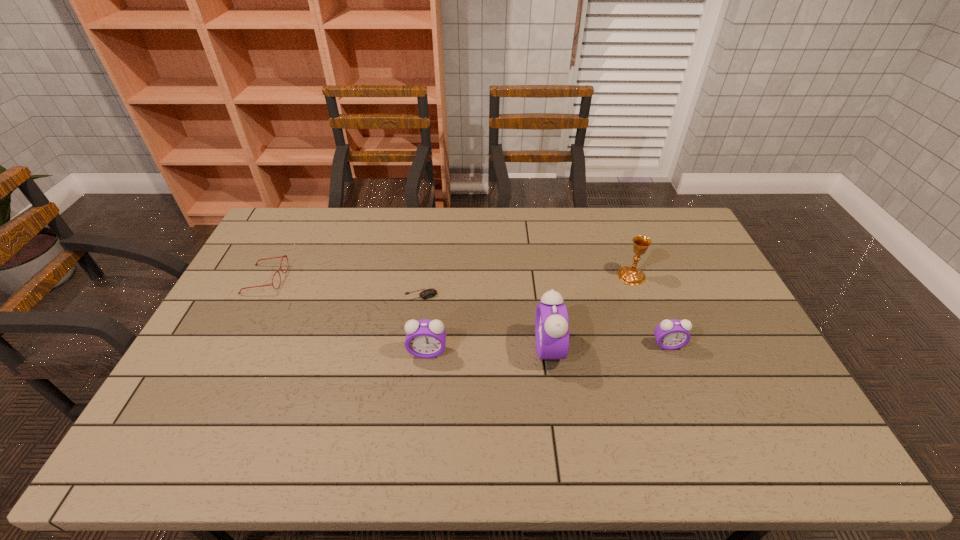
Find the location of a particular element. The image size is (960, 540). free space for a new alarm clock on the left is located at coordinates (304, 355).